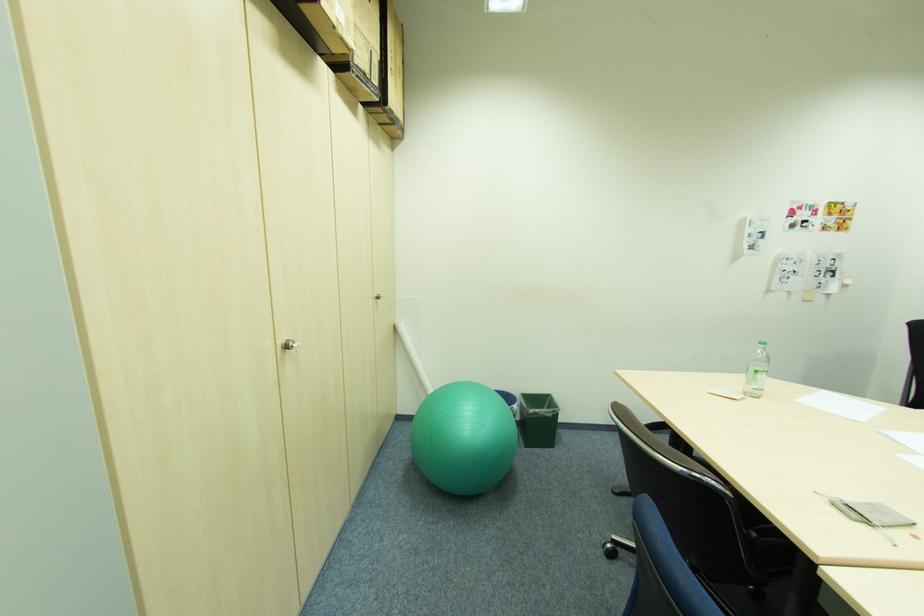
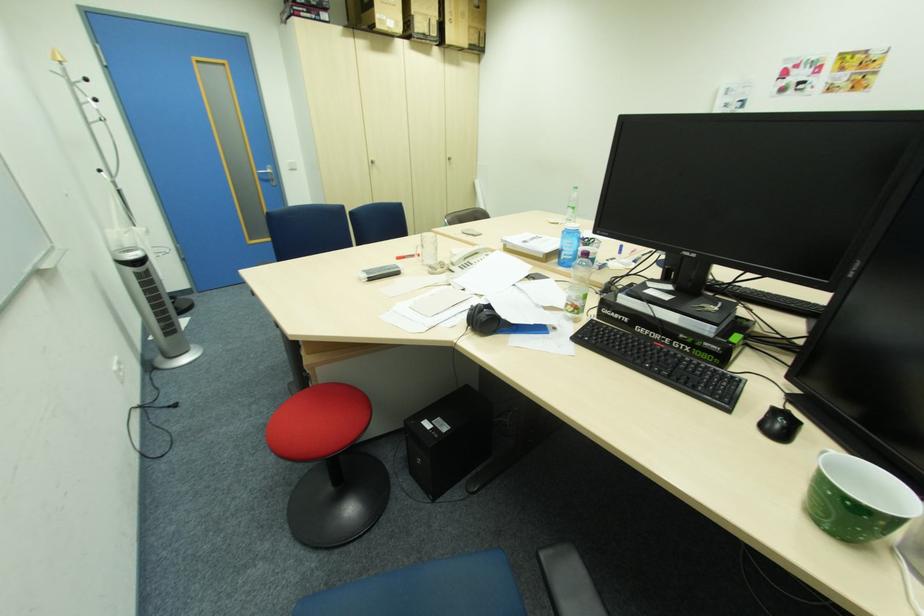
Find the pixel in the second image that matches pixel 382 79 in the first image.

(441, 31)